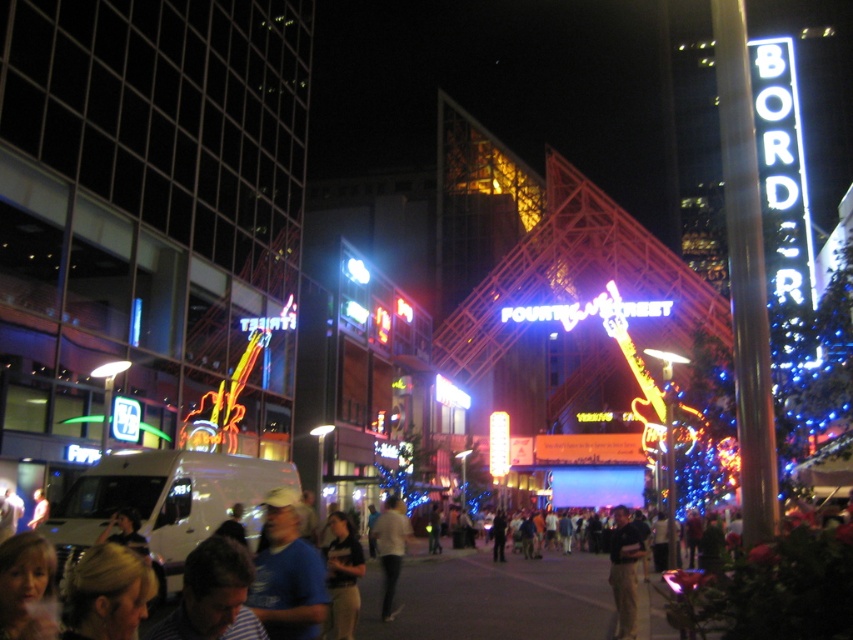
Can you confirm if blue matte shirt at lower center is positioned to the right of dark blue shirt at center?

Incorrect, blue matte shirt at lower center is not on the right side of dark blue shirt at center.

Between blue matte shirt at lower center and dark blue shirt at center, which one appears on the left side from the viewer's perspective?

blue matte shirt at lower center is more to the left.

Does point (322, 608) come in front of point (614, 602)?

Yes, point (322, 608) is in front of point (614, 602).

You are a GUI agent. You are given a task and a screenshot of the screen. Output one action in this format:
    pyautogui.click(x=<x>, y=<y>)
    Task: Click on the blue matte shirt at lower center
    This screenshot has height=640, width=853.
    Given the screenshot: What is the action you would take?
    pyautogui.click(x=287, y=573)

Who is shorter, dark blue shirt at center or light beige pants at center?

Standing shorter between the two is light beige pants at center.

Between dark blue shirt at center and light beige pants at center, which one appears on the right side from the viewer's perspective?

dark blue shirt at center

Is point (622, 632) more distant than point (390, 576)?

No, (622, 632) is closer to viewer.

The height and width of the screenshot is (640, 853). Identify the location of dark blue shirt at center. (624, 572).

Does point (323, 586) lie in front of point (399, 504)?

Yes, it is.

Which is behind, point (270, 630) or point (381, 564)?

The point (381, 564) is behind.

You are a GUI agent. You are given a task and a screenshot of the screen. Output one action in this format:
    pyautogui.click(x=<x>, y=<y>)
    Task: Click on the blue matte shirt at lower center
    
    Given the screenshot: What is the action you would take?
    pyautogui.click(x=287, y=573)